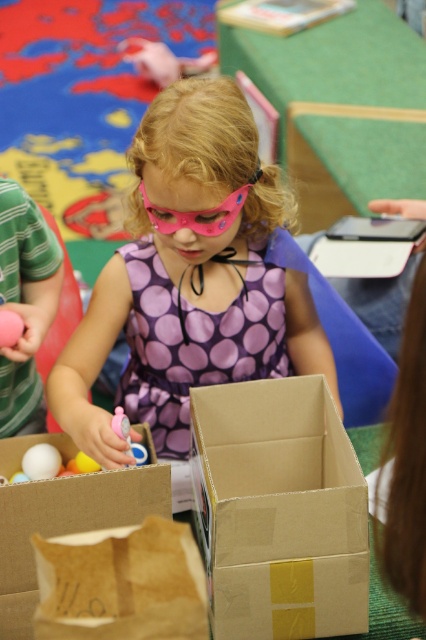
You are organizing a craft activity and need to place the brown paper bag at lower left and the white matte egg at center into a storage box. Since the storage box has limited height, which object should you prioritize placing first to ensure it fits?

The brown paper bag at lower left is taller than the white matte egg at center, so you should prioritize placing the white matte egg at center first as it is shorter and more likely to fit in the storage box with limited height.

You are standing in the classroom and want to place a small toy between the two points, point (141, 504) and point (58, 461). Which point should you place it closer to so that it appears closer to you?

You should place the small toy closer to point (141, 504) because it is closer to the viewer than point (58, 461).